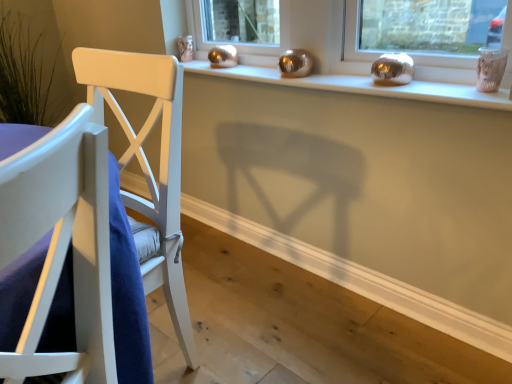
The image size is (512, 384). Find the location of `empty space that is ontop of satin gold ornaments at upper center`. empty space that is ontop of satin gold ornaments at upper center is located at coordinates (301, 76).